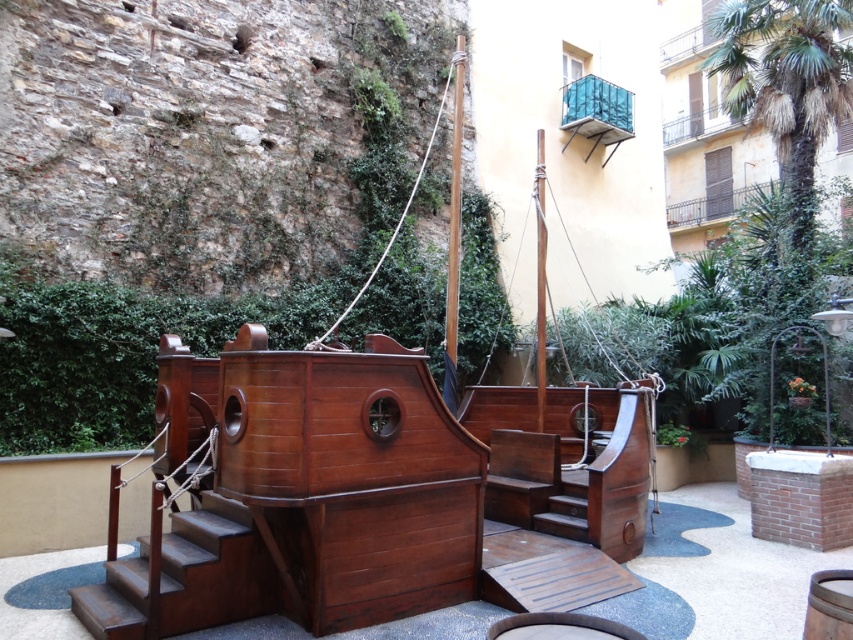
Which is more to the left, green leafy palm tree at upper right or smooth brown mast at center?

Positioned to the left is smooth brown mast at center.

Between point (782, 26) and point (534, 182), which one is positioned behind?

The point (782, 26) is more distant.

Locate an element on the screen. green leafy palm tree at upper right is located at coordinates (786, 90).

Does shiny brown wooden boat at center appear on the left side of smooth brown mast at center?

Correct, you'll find shiny brown wooden boat at center to the left of smooth brown mast at center.

Does shiny brown wooden boat at center have a smaller size compared to smooth brown mast at center?

Actually, shiny brown wooden boat at center might be larger than smooth brown mast at center.

Is point (300, 525) positioned after point (537, 236)?

No.

Identify the location of shiny brown wooden boat at center. (360, 499).

Does point (456, 104) come farther from viewer compared to point (538, 173)?

No, (456, 104) is closer to viewer.

Is wooden mast at upper center smaller than smooth brown mast at center?

No.

Who is more forward, (450, 392) or (537, 209)?

Point (450, 392)

You are a GUI agent. You are given a task and a screenshot of the screen. Output one action in this format:
    pyautogui.click(x=<x>, y=<y>)
    Task: Click on the wooden mast at upper center
    
    Given the screenshot: What is the action you would take?
    pyautogui.click(x=453, y=234)